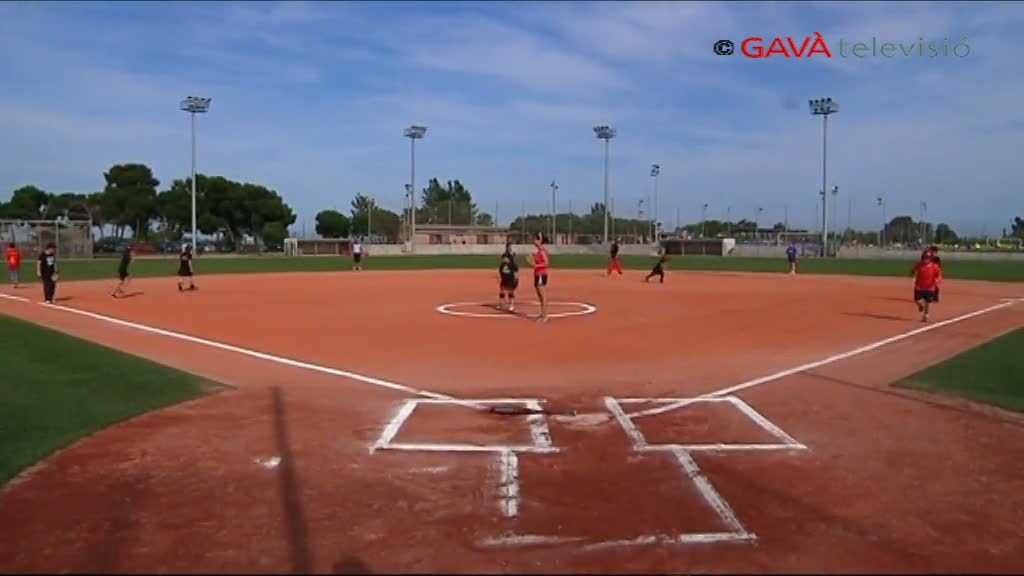
You are a GUI agent. You are given a task and a screenshot of the screen. Output one action in this format:
    pyautogui.click(x=<x>, y=<y>)
    Task: Click on the lights
    This screenshot has height=576, width=1024.
    Given the screenshot: What is the action you would take?
    pyautogui.click(x=197, y=98), pyautogui.click(x=414, y=124), pyautogui.click(x=605, y=125), pyautogui.click(x=822, y=100)